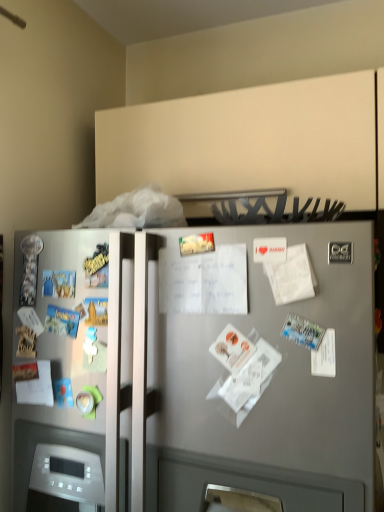
Describe the element at coordinates (292, 276) in the screenshot. I see `white matte paper at center-right, marked as the third paper in a bottom-to-top arrangement` at that location.

This screenshot has width=384, height=512. In order to click on white paper at center, which is counted as the second paper, starting from the bottom in this screenshot , I will do `click(243, 371)`.

At what (x,y) coordinates should I click in order to perform the action: click on white paper at left, marked as the first paper in a back-to-front arrangement. Please return your answer as a coordinate pair (x, y). The image size is (384, 512). Looking at the image, I should click on (37, 387).

Which point is more forward, [270,279] or [33,403]?

The point [270,279] is closer to the camera.

Between white matte paper at center-right, marked as the third paper in a bottom-to-top arrangement, and white paper at left, arranged as the 3th paper when viewed from the front, which one has larger size?

white paper at left, arranged as the 3th paper when viewed from the front, is bigger.

Locate an element on the screen. The image size is (384, 512). paper that appears behind the white matte paper at center-right, the first paper when ordered from right to left is located at coordinates (37, 387).

Considering the relative sizes of white matte paper at center-right, marked as the third paper in a bottom-to-top arrangement, and white paper at left, arranged as the 3th paper when viewed from the front, in the image provided, is white matte paper at center-right, marked as the third paper in a bottom-to-top arrangement, wider than white paper at left, arranged as the 3th paper when viewed from the front,?

Incorrect, the width of white matte paper at center-right, marked as the third paper in a bottom-to-top arrangement, does not surpass that of white paper at left, arranged as the 3th paper when viewed from the front.

Which object is closer to the camera, white paper at left, positioned as the third paper in right-to-left order, or satin silver refrigerator at center?

satin silver refrigerator at center.

Considering the relative positions of white paper at left, which is counted as the 1th paper, starting from the bottom, and satin silver refrigerator at center in the image provided, is white paper at left, which is counted as the 1th paper, starting from the bottom, to the right of satin silver refrigerator at center from the viewer's perspective?

No, white paper at left, which is counted as the 1th paper, starting from the bottom, is not to the right of satin silver refrigerator at center.

Is white paper at left, arranged as the 3th paper when viewed from the front, in contact with satin silver refrigerator at center?

They are not placed beside each other.

From a real-world perspective, which object stands above the other?

white paper at left, positioned as the third paper in right-to-left order, is physically above.

Can you confirm if white matte paper at center-right, marked as the third paper in a bottom-to-top arrangement, is bigger than white paper at center, which is counted as the second paper, starting from the bottom?

Actually, white matte paper at center-right, marked as the third paper in a bottom-to-top arrangement, might be smaller than white paper at center, which is counted as the second paper, starting from the bottom.

From the image's perspective, which is below, white matte paper at center-right, the first paper when ordered from right to left, or white paper at center, which ranks as the 2th paper in left-to-right order?

white paper at center, which ranks as the 2th paper in left-to-right order, appears lower in the image.

From a real-world perspective, between white matte paper at center-right, marked as the third paper in a bottom-to-top arrangement, and white paper at center, which ranks as the 2th paper in left-to-right order, who is vertically lower?

white paper at center, which ranks as the 2th paper in left-to-right order, is physically lower.

Can we say white matte paper at center-right, the third paper from the left, lies outside white paper at center, which appears as the 3th paper when viewed from the back?

Yes, white matte paper at center-right, the third paper from the left, is not within white paper at center, which appears as the 3th paper when viewed from the back.

Considering the positions of point (354, 323) and point (25, 397), is point (354, 323) closer or farther from the camera than point (25, 397)?

Point (354, 323).

Which is more to the left, satin silver refrigerator at center or white paper at left, arranged as the 3th paper when viewed from the top?

Positioned to the left is white paper at left, arranged as the 3th paper when viewed from the top.

Is the surface of satin silver refrigerator at center in direct contact with white paper at left, arranged as the 3th paper when viewed from the top?

There is a gap between satin silver refrigerator at center and white paper at left, arranged as the 3th paper when viewed from the top.

Consider the image. From the image's perspective, which object appears higher, satin silver refrigerator at center or white paper at left, arranged as the 3th paper when viewed from the top?

From the image's view, white paper at left, arranged as the 3th paper when viewed from the top, is above.

Between point (121, 484) and point (233, 412), which one is positioned in front?

The point (233, 412) is closer to the camera.

Would you say satin silver refrigerator at center is to the left or to the right of white paper at center, the second paper from the right, in the picture?

From the image, it's evident that satin silver refrigerator at center is to the left of white paper at center, the second paper from the right.

From a real-world perspective, is satin silver refrigerator at center positioned under white paper at center, marked as the first paper in a front-to-back arrangement, based on gravity?

Indeed, from a real-world perspective, satin silver refrigerator at center is positioned beneath white paper at center, marked as the first paper in a front-to-back arrangement.

Where is `the 1st paper to the left of the white matte paper at center-right, the 1th paper viewed from the top, starting your count from the anchor`? This screenshot has width=384, height=512. the 1st paper to the left of the white matte paper at center-right, the 1th paper viewed from the top, starting your count from the anchor is located at coordinates (243, 371).

Considering the relative sizes of white paper at center, the second paper from the right, and white matte paper at center-right, the 2th paper when ordered from back to front, in the image provided, is white paper at center, the second paper from the right, bigger than white matte paper at center-right, the 2th paper when ordered from back to front,?

Yes.

Which is more to the right, white paper at center, which is counted as the second paper, starting from the bottom, or white matte paper at center-right, the 2th paper when ordered from back to front?

white matte paper at center-right, the 2th paper when ordered from back to front, is more to the right.

Is point (254, 398) behind point (291, 298)?

Yes, it is.

Is white paper at center, the second paper from the right, inside the boundaries of white paper at left, marked as the first paper in a back-to-front arrangement, or outside?

The correct answer is: outside.

Is white paper at center, which ranks as the second paper in top-to-bottom order, next to white paper at left, marked as the first paper in a left-to-right arrangement, and touching it?

There is a gap between white paper at center, which ranks as the second paper in top-to-bottom order, and white paper at left, marked as the first paper in a left-to-right arrangement.

From a real-world perspective, who is located higher, white paper at center, which ranks as the 2th paper in left-to-right order, or white paper at left, marked as the first paper in a left-to-right arrangement?

white paper at center, which ranks as the 2th paper in left-to-right order, from a real-world perspective.

Identify the location of paper that is the 1st object located in front of the white paper at left, arranged as the 3th paper when viewed from the top. (292, 276).

Locate an element on the screen. the 1st paper above the satin silver refrigerator at center (from the image's perspective) is located at coordinates (37, 387).

In the scene shown: Estimate the real-world distances between objects in this image. Which object is further from white matte paper at center-right, the 1th paper viewed from the top, satin silver refrigerator at center or white paper at left, marked as the first paper in a left-to-right arrangement?

Among the two, white paper at left, marked as the first paper in a left-to-right arrangement, is located further to white matte paper at center-right, the 1th paper viewed from the top.

Estimate the real-world distances between objects in this image. Which object is closer to white paper at center, the second paper from the right, white matte paper at center-right, the first paper when ordered from right to left, or satin silver refrigerator at center?

Based on the image, white matte paper at center-right, the first paper when ordered from right to left, appears to be nearer to white paper at center, the second paper from the right.

Estimate the real-world distances between objects in this image. Which object is closer to white paper at left, arranged as the 3th paper when viewed from the front, white matte paper at center-right, placed as the second paper when sorted from front to back, or white paper at center, which is counted as the second paper, starting from the bottom?

white paper at center, which is counted as the second paper, starting from the bottom, is closer to white paper at left, arranged as the 3th paper when viewed from the front.

When comparing their distances from white paper at center, the second paper from the right, does white matte paper at center-right, the 2th paper when ordered from back to front, or white paper at left, arranged as the 3th paper when viewed from the top, seem further?

The object further to white paper at center, the second paper from the right, is white paper at left, arranged as the 3th paper when viewed from the top.

When comparing their distances from white matte paper at center-right, the first paper when ordered from right to left, does white paper at center, which ranks as the second paper in top-to-bottom order, or satin silver refrigerator at center seem closer?

The object closer to white matte paper at center-right, the first paper when ordered from right to left, is white paper at center, which ranks as the second paper in top-to-bottom order.

Looking at the image, which one is located further to white matte paper at center-right, the 1th paper viewed from the top, white paper at left, which is counted as the 1th paper, starting from the bottom, or satin silver refrigerator at center?

white paper at left, which is counted as the 1th paper, starting from the bottom.

From the image, which object appears to be farther from satin silver refrigerator at center, white matte paper at center-right, marked as the third paper in a bottom-to-top arrangement, or white paper at left, marked as the first paper in a left-to-right arrangement?

white paper at left, marked as the first paper in a left-to-right arrangement.

Consider the image. Estimate the real-world distances between objects in this image. Which object is further from white paper at center, which is counted as the second paper, starting from the bottom, satin silver refrigerator at center or white paper at left, marked as the first paper in a left-to-right arrangement?

The object further to white paper at center, which is counted as the second paper, starting from the bottom, is white paper at left, marked as the first paper in a left-to-right arrangement.

At what (x,y) coordinates should I click in order to perform the action: click on paper located between white paper at left, arranged as the 3th paper when viewed from the top, and white matte paper at center-right, the 2th paper when ordered from back to front, in the left-right direction. Please return your answer as a coordinate pair (x, y). Looking at the image, I should click on (243, 371).

Find the location of a particular element. The height and width of the screenshot is (512, 384). refrigerator located between white paper at left, marked as the first paper in a left-to-right arrangement, and white paper at center, which ranks as the second paper in top-to-bottom order, in the left-right direction is located at coordinates (197, 372).

Where is `refrigerator between white paper at left, marked as the first paper in a left-to-right arrangement, and white matte paper at center-right, marked as the third paper in a bottom-to-top arrangement, in the horizontal direction`? This screenshot has height=512, width=384. refrigerator between white paper at left, marked as the first paper in a left-to-right arrangement, and white matte paper at center-right, marked as the third paper in a bottom-to-top arrangement, in the horizontal direction is located at coordinates (197, 372).